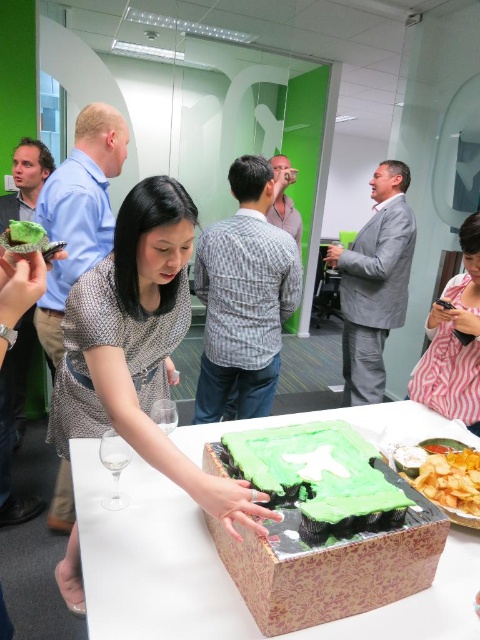
Is green frosted cake at center below pink striped shirt at lower right?

Correct, green frosted cake at center is located below pink striped shirt at lower right.

Can you confirm if green frosted cake at center is smaller than pink striped shirt at lower right?

Yes, green frosted cake at center is smaller than pink striped shirt at lower right.

Where is `green frosted cake at center`? Image resolution: width=480 pixels, height=640 pixels. green frosted cake at center is located at coordinates (314, 472).

Which of these two, matte green cake at center or gray suit at center, stands taller?

gray suit at center is taller.

Between matte green cake at center and gray suit at center, which one has less height?

matte green cake at center

Who is more distant from viewer, [133,221] or [393,326]?

Point [393,326]

Find the location of `matte green cake at center`. matte green cake at center is located at coordinates (139, 346).

Which is below, green paper cake at center or crunchy golden chips at lower right?

crunchy golden chips at lower right

Is green paper cake at center smaller than crunchy golden chips at lower right?

No, green paper cake at center is not smaller than crunchy golden chips at lower right.

Between point (179, 515) and point (423, 461), which one is positioned behind?

Positioned behind is point (423, 461).

Find the location of a particular element. Image resolution: width=480 pixels, height=640 pixels. green paper cake at center is located at coordinates (151, 560).